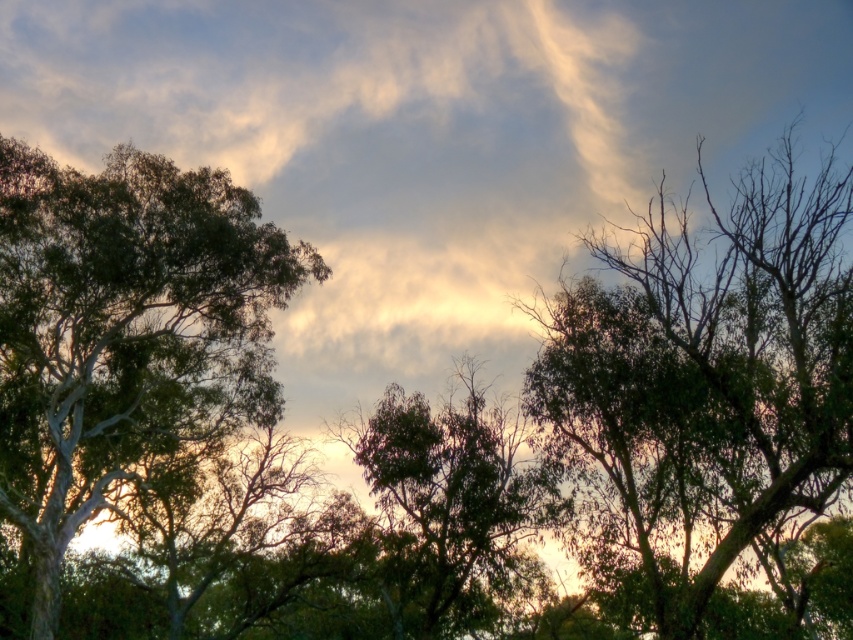
Question: Is green leafy tree at upper left bigger than green leafy tree at center?

Choices:
 (A) no
 (B) yes

Answer: (B)

Question: Where is green leafy tree at right located in relation to green leafy tree at upper left in the image?

Choices:
 (A) above
 (B) below

Answer: (A)

Question: Which object is the closest to the green leafy tree at center?

Choices:
 (A) green leafy tree at upper left
 (B) green leafy tree at right

Answer: (B)

Question: Which of these objects is positioned closest to the green leafy tree at center?

Choices:
 (A) green leafy tree at upper left
 (B) green leafy tree at right

Answer: (B)

Question: Can you confirm if green leafy tree at right is thinner than green leafy tree at upper left?

Choices:
 (A) no
 (B) yes

Answer: (B)

Question: Which point is farther from the camera taking this photo?

Choices:
 (A) (426, 433)
 (B) (114, 417)
 (C) (590, 449)

Answer: (A)